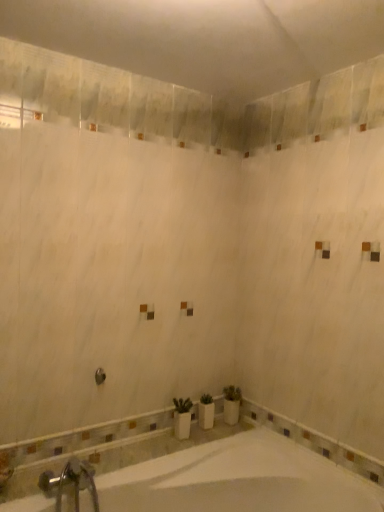
Measure the distance between brushed metal showerhead at center and camera.

brushed metal showerhead at center is 6.77 feet from camera.

You are a GUI agent. You are given a task and a screenshot of the screen. Output one action in this format:
    pyautogui.click(x=<x>, y=<y>)
    Task: Click on the brushed metal showerhead at center
    
    Given the screenshot: What is the action you would take?
    pyautogui.click(x=100, y=376)

What is the approximate height of silver metallic faucet at lower left?

28.03 centimeters.

The width and height of the screenshot is (384, 512). In order to click on brushed metal showerhead at center in this screenshot , I will do `click(100, 376)`.

Is brushed metal showerhead at center located outside silver metallic faucet at lower left?

Yes, brushed metal showerhead at center is not within silver metallic faucet at lower left.

Is brushed metal showerhead at center placed right next to silver metallic faucet at lower left?

There is a gap between brushed metal showerhead at center and silver metallic faucet at lower left.

Is point (96, 377) positioned before point (65, 468)?

No, it is not.

Consider the image. Considering the relative sizes of white glossy bathtub at lower center and brushed metal showerhead at center in the image provided, is white glossy bathtub at lower center shorter than brushed metal showerhead at center?

No.

Is white glossy bathtub at lower center oriented away from brushed metal showerhead at center?

No, white glossy bathtub at lower center's orientation is not away from brushed metal showerhead at center.

Is brushed metal showerhead at center located within white glossy bathtub at lower center?

No, brushed metal showerhead at center is not surrounded by white glossy bathtub at lower center.

Is white glossy bathtub at lower center positioned in front of brushed metal showerhead at center?

Yes, white glossy bathtub at lower center is in front of brushed metal showerhead at center.

Which is behind, point (99, 382) or point (166, 487)?

Point (99, 382)

Measure the distance from brushed metal showerhead at center to white glossy bathtub at lower center.

brushed metal showerhead at center is 30.05 inches away from white glossy bathtub at lower center.

Which is in front, brushed metal showerhead at center or white glossy bathtub at lower center?

white glossy bathtub at lower center is closer to the camera.

Is brushed metal showerhead at center turned away from white glossy bathtub at lower center?

No, brushed metal showerhead at center's orientation is not away from white glossy bathtub at lower center.

Is silver metallic faucet at lower left positioned with its back to brushed metal showerhead at center?

No, brushed metal showerhead at center is not at the back of silver metallic faucet at lower left.

Between point (94, 490) and point (100, 370), which one is positioned in front?

The point (94, 490) is closer.

From the picture: Is silver metallic faucet at lower left not inside brushed metal showerhead at center?

silver metallic faucet at lower left is positioned outside brushed metal showerhead at center.

From the image's perspective, between silver metallic faucet at lower left and brushed metal showerhead at center, which one is located above?

brushed metal showerhead at center.

Does white glossy bathtub at lower center have a greater height compared to silver metallic faucet at lower left?

Yes, white glossy bathtub at lower center is taller than silver metallic faucet at lower left.

Consider the image. Is white glossy bathtub at lower center positioned before silver metallic faucet at lower left?

Yes, the depth of white glossy bathtub at lower center is less than that of silver metallic faucet at lower left.

Between white glossy bathtub at lower center and silver metallic faucet at lower left, which one has larger width?

white glossy bathtub at lower center is wider.

Is silver metallic faucet at lower left completely or partially inside white glossy bathtub at lower center?

Yes, silver metallic faucet at lower left is surrounded by white glossy bathtub at lower center.

In terms of height, does silver metallic faucet at lower left look taller or shorter compared to white glossy bathtub at lower center?

Clearly, silver metallic faucet at lower left is shorter compared to white glossy bathtub at lower center.

Is point (81, 468) less distant than point (269, 506)?

Yes, it is in front of point (269, 506).

In the scene shown: From a real-world perspective, is silver metallic faucet at lower left physically located above or below white glossy bathtub at lower center?

From a real-world perspective, silver metallic faucet at lower left is physically above white glossy bathtub at lower center.

What's the angular difference between silver metallic faucet at lower left and white glossy bathtub at lower center's facing directions?

They differ by 8.8e-05 degrees in their facing directions.

The image size is (384, 512). I want to click on tap located in front of the brushed metal showerhead at center, so click(x=71, y=482).

Locate an element on the screen. bathtub on the right of brushed metal showerhead at center is located at coordinates (234, 478).

Considering their positions, is white glossy bathtub at lower center positioned closer to brushed metal showerhead at center than silver metallic faucet at lower left?

silver metallic faucet at lower left lies closer to brushed metal showerhead at center than the other object.

Which object lies nearer to the anchor point silver metallic faucet at lower left, brushed metal showerhead at center or white glossy bathtub at lower center?

white glossy bathtub at lower center is positioned closer to the anchor silver metallic faucet at lower left.

Consider the image. When comparing their distances from brushed metal showerhead at center, does silver metallic faucet at lower left or white glossy bathtub at lower center seem further?

Based on the image, white glossy bathtub at lower center appears to be further to brushed metal showerhead at center.

From the picture: Considering their positions, is brushed metal showerhead at center positioned further to white glossy bathtub at lower center than silver metallic faucet at lower left?

brushed metal showerhead at center is positioned further to the anchor white glossy bathtub at lower center.

Which object lies further to the anchor point silver metallic faucet at lower left, white glossy bathtub at lower center or brushed metal showerhead at center?

brushed metal showerhead at center is positioned further to the anchor silver metallic faucet at lower left.

Based on their spatial positions, is silver metallic faucet at lower left or brushed metal showerhead at center further from white glossy bathtub at lower center?

Among the two, brushed metal showerhead at center is located further to white glossy bathtub at lower center.

Where is `tap between white glossy bathtub at lower center and brushed metal showerhead at center along the z-axis`? The width and height of the screenshot is (384, 512). tap between white glossy bathtub at lower center and brushed metal showerhead at center along the z-axis is located at coordinates (71, 482).